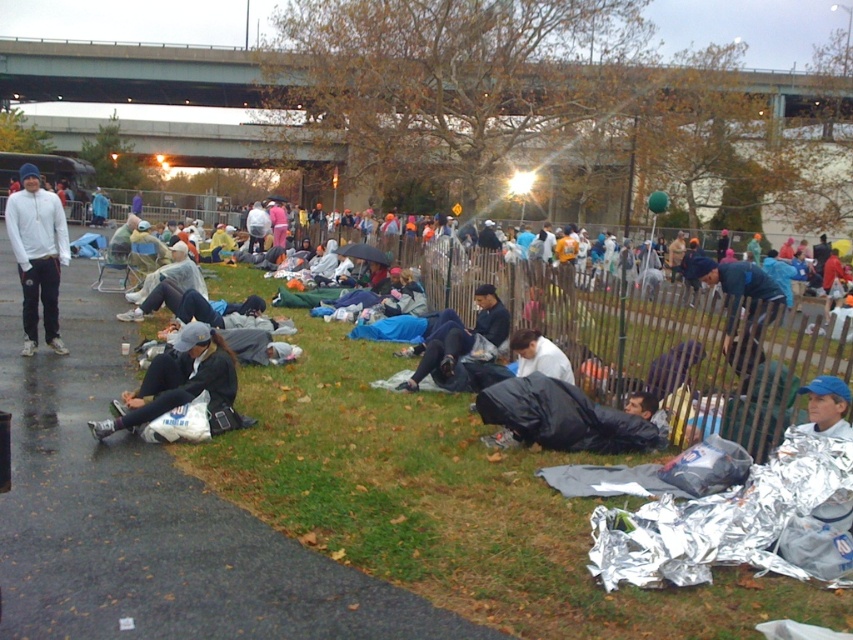
You are a photographer trying to capture a photo that includes both the green concrete bridge at upper center and the white matte shirt at center. Based on their positions, which object should you adjust your camera angle to focus on first to ensure both are in frame?

The green concrete bridge at upper center is to the left of the white matte shirt at center. To include both in the frame, focus on the green concrete bridge at upper center first since it is positioned to the left of the white matte shirt at center, ensuring both are captured.

You are organizing a small gathering and need to set up a 3m wide tent. Looking at the image, can the metallic wire fence at center and the green concrete bridge at upper center accommodate the tent between them?

The metallic wire fence at center is narrower than the green concrete bridge at upper center. However, the exact distance between them isn not specified in the objects description. Therefore, it is uncertain if the 3m wide tent will fit between them.